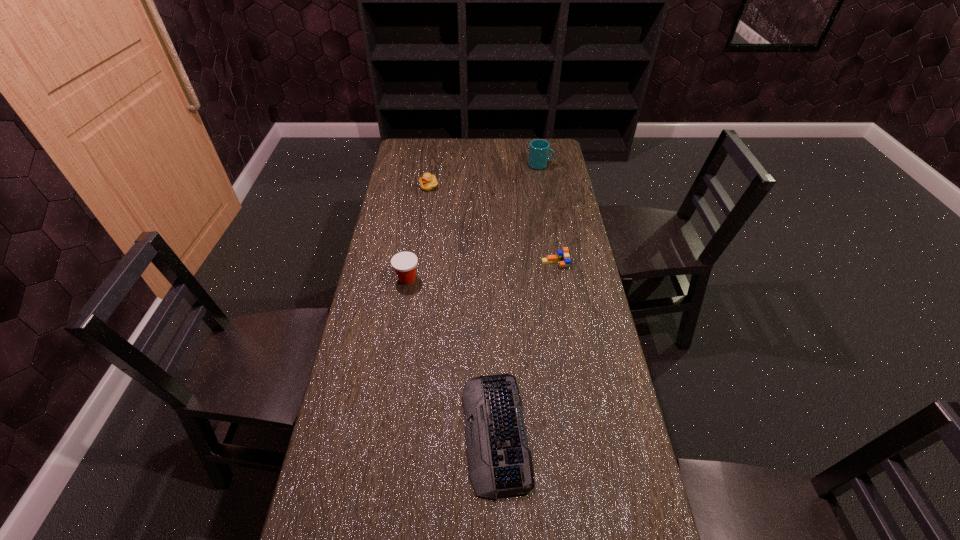
Locate an element on the screen. the farthest object is located at coordinates (539, 149).

Locate an element on the screen. The height and width of the screenshot is (540, 960). cup is located at coordinates (539, 149).

The height and width of the screenshot is (540, 960). I want to click on the second nearest object, so click(x=404, y=263).

The image size is (960, 540). Find the location of `Dixie cup`. Dixie cup is located at coordinates (404, 263).

I want to click on the fourth nearest object, so click(x=428, y=182).

Where is `the third tallest object`? The width and height of the screenshot is (960, 540). the third tallest object is located at coordinates (428, 182).

The width and height of the screenshot is (960, 540). Find the location of `the fourth tallest object`. the fourth tallest object is located at coordinates (562, 257).

I want to click on the third farthest object, so click(x=562, y=257).

Where is `the nearest object`? Image resolution: width=960 pixels, height=540 pixels. the nearest object is located at coordinates (500, 463).

The image size is (960, 540). I want to click on the shortest object, so click(x=500, y=463).